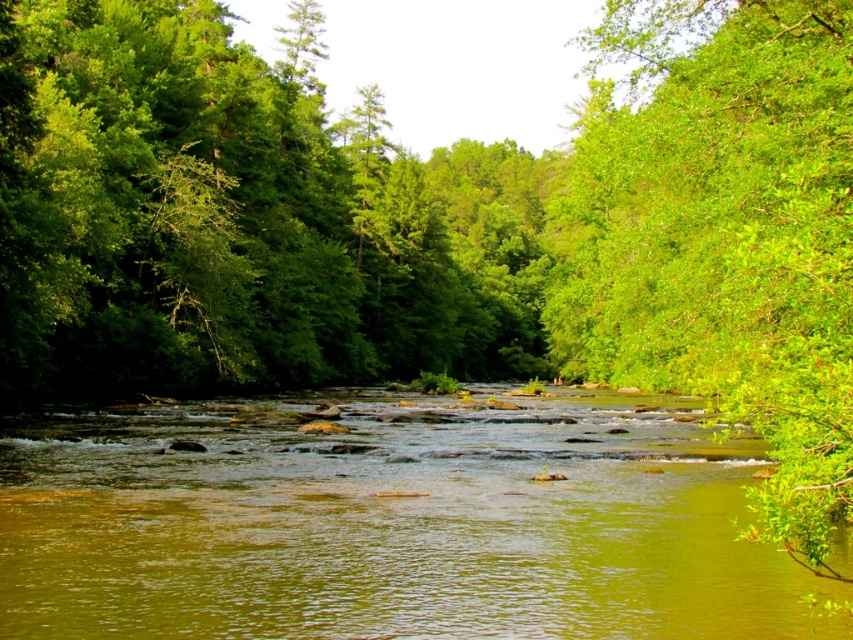
I want to click on green smooth water at center, so click(392, 524).

Can you confirm if green smooth water at center is wider than green leafy tree at center?

No, green smooth water at center is not wider than green leafy tree at center.

Where is `green smooth water at center`? green smooth water at center is located at coordinates (392, 524).

Where is `green smooth water at center`? green smooth water at center is located at coordinates (392, 524).

Between point (241, 531) and point (766, 275), which one is positioned in front?

Point (766, 275) is in front.

Between green smooth water at center and green leafy tree at right, which one has less height?

green smooth water at center

Where is `green smooth water at center`? Image resolution: width=853 pixels, height=640 pixels. green smooth water at center is located at coordinates (392, 524).

Where is `green smooth water at center`? The width and height of the screenshot is (853, 640). green smooth water at center is located at coordinates (392, 524).

Which is in front, point (152, 80) or point (827, 264)?

Point (827, 264)

Find the location of a particular element. This screenshot has height=640, width=853. green leafy tree at center is located at coordinates (239, 218).